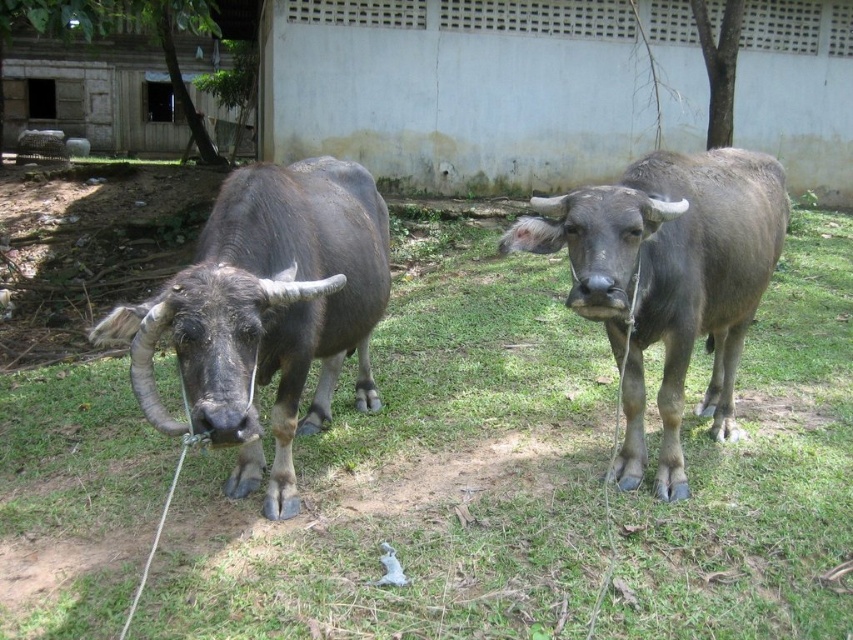
Question: Which point is closer to the camera?

Choices:
 (A) dark brown glossy bull at center
 (B) green grass at center
 (C) gray matte bull at center

Answer: (A)

Question: Does green grass at center have a larger size compared to dark brown glossy bull at center?

Choices:
 (A) no
 (B) yes

Answer: (A)

Question: Is dark brown glossy bull at center closer to camera compared to gray matte bull at center?

Choices:
 (A) no
 (B) yes

Answer: (B)

Question: Observing the image, what is the correct spatial positioning of dark brown glossy bull at center in reference to gray matte bull at center?

Choices:
 (A) right
 (B) left

Answer: (B)

Question: Among these objects, which one is nearest to the camera?

Choices:
 (A) gray matte bull at center
 (B) green grass at center

Answer: (A)

Question: Among these objects, which one is farthest from the camera?

Choices:
 (A) green grass at center
 (B) dark brown glossy bull at center

Answer: (A)